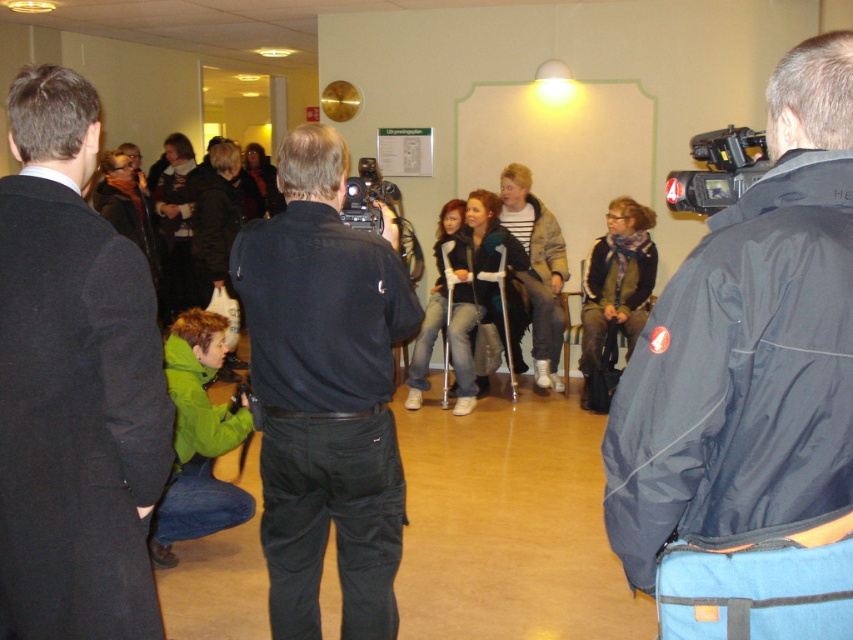
Is dark blue jacket at center taller than dark gray coat at left?

Incorrect, dark blue jacket at center's height is not larger of dark gray coat at left's.

Between dark blue jacket at center and dark gray coat at left, which one has more height?

With more height is dark gray coat at left.

The image size is (853, 640). I want to click on dark blue jacket at center, so click(x=749, y=349).

Where is `dark blue jacket at center`? The height and width of the screenshot is (640, 853). dark blue jacket at center is located at coordinates tap(749, 349).

From the picture: Is black cotton shirt at center taller than black plastic video camera at center?

Correct, black cotton shirt at center is much taller as black plastic video camera at center.

Is black cotton shirt at center smaller than black plastic video camera at center?

Incorrect, black cotton shirt at center is not smaller in size than black plastic video camera at center.

Does point (253, 371) come farther from viewer compared to point (358, 193)?

No, (253, 371) is closer to viewer.

I want to click on black cotton shirt at center, so click(x=325, y=390).

Which is below, black cotton shirt at center or black plastic video camera at upper right?

black cotton shirt at center

Where is `black cotton shirt at center`? The height and width of the screenshot is (640, 853). black cotton shirt at center is located at coordinates (325, 390).